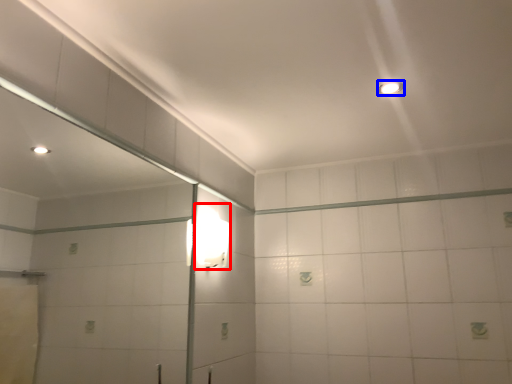
Question: Which point is further to the camera, light fixture (highlighted by a red box) or light fixture (highlighted by a blue box)?

Choices:
 (A) light fixture
 (B) light fixture

Answer: (A)